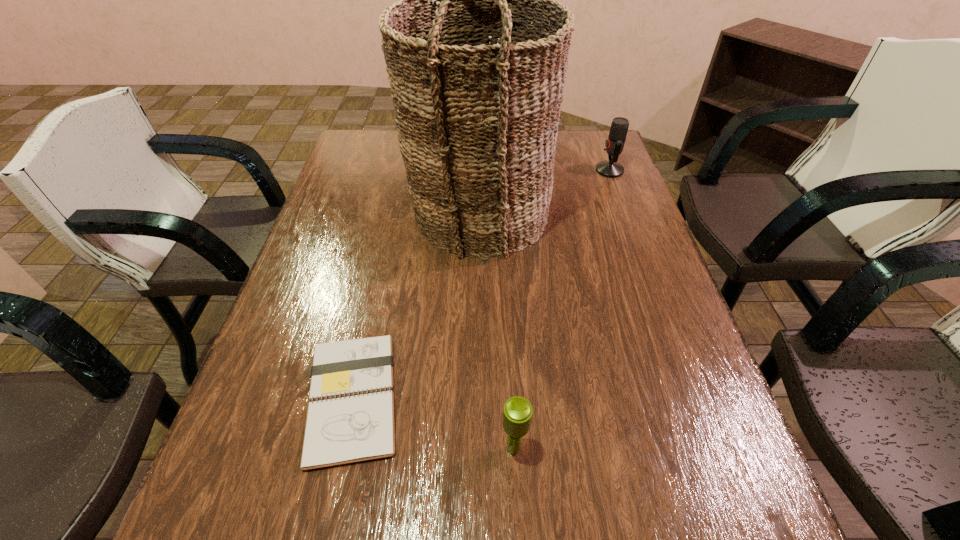
Where is `vacant space located on the right of the notepad`? The image size is (960, 540). vacant space located on the right of the notepad is located at coordinates (496, 397).

What are the coordinates of `object positioned at the far edge` in the screenshot? It's located at (614, 144).

This screenshot has width=960, height=540. Find the location of `object that is at the left edge`. object that is at the left edge is located at coordinates tap(351, 417).

Where is `object that is at the right edge`? object that is at the right edge is located at coordinates (614, 144).

This screenshot has height=540, width=960. Find the location of `object that is at the far right corner`. object that is at the far right corner is located at coordinates (614, 144).

I want to click on free space at the left edge, so point(296,436).

In the image, there is a desktop. Identify the location of vacant space at the right edge. The width and height of the screenshot is (960, 540). (656, 454).

Image resolution: width=960 pixels, height=540 pixels. What are the coordinates of `vacant space at the far left corner of the desktop` in the screenshot? It's located at (372, 159).

I want to click on vacant space at the far right corner of the desktop, so click(586, 137).

Identify the location of empty location between the notepad and the rightmost object. This screenshot has width=960, height=540. (481, 284).